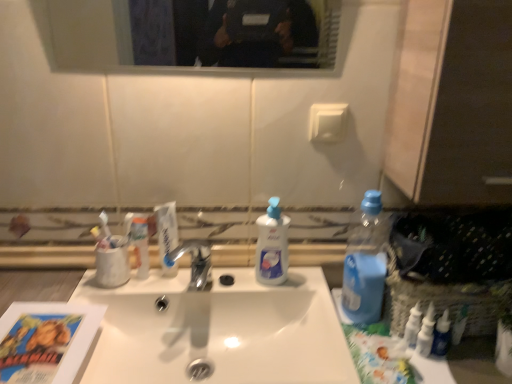
Identify the location of vacant area located to the right-hand side of translucent plastic tube at center, which appears as the 3th toiletry when viewed from the front. (205, 284).